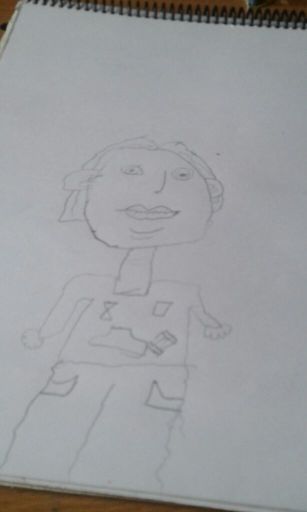
The width and height of the screenshot is (307, 512). What are the coordinates of `wooden desk` in the screenshot? It's located at click(6, 6).